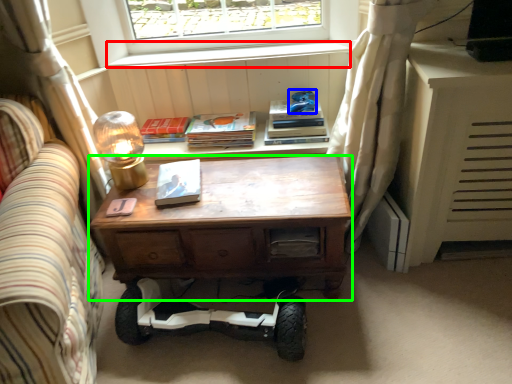
Question: Which object is the farthest from window sill (highlighted by a red box)? Choose among these: toy (highlighted by a blue box) or desk (highlighted by a green box).

Choices:
 (A) toy
 (B) desk

Answer: (B)